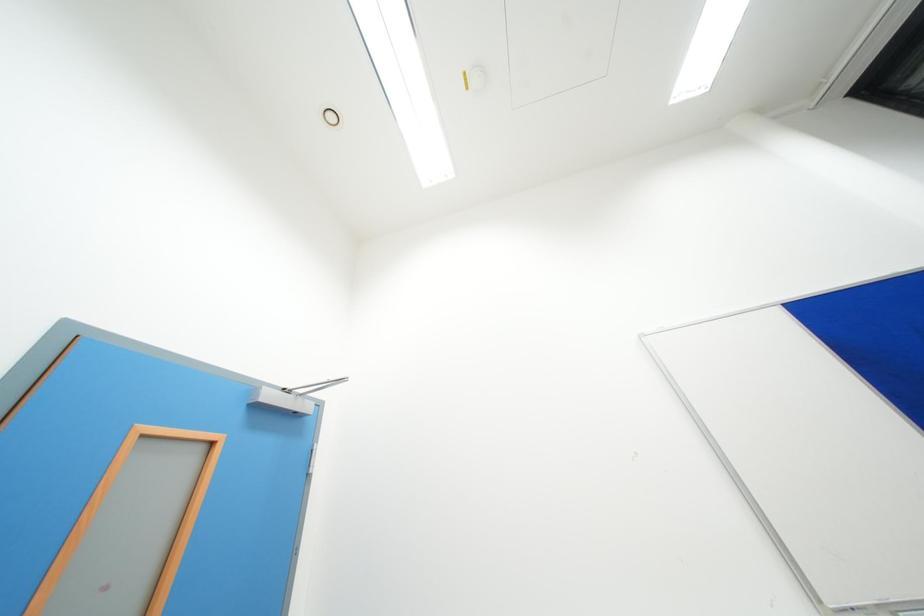
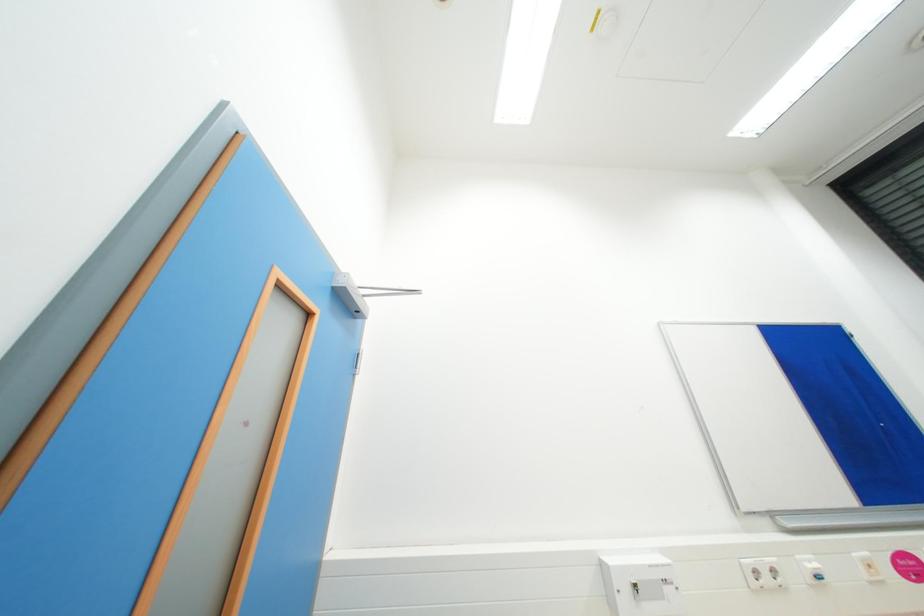
Question: How did the camera likely rotate?

Choices:
 (A) Left
 (B) Right
 (C) Up
 (D) Down

Answer: (B)